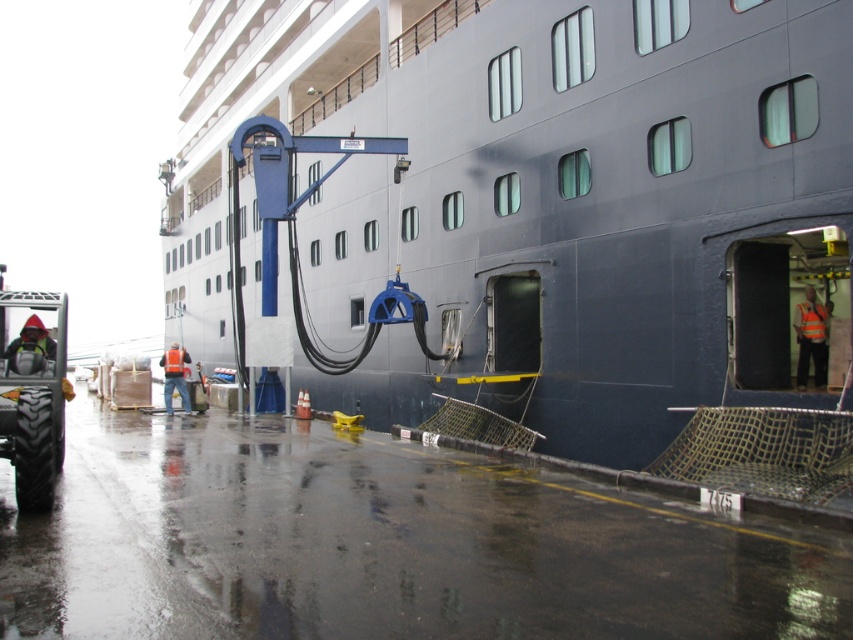
You are standing on the dock and want to board the dark blue metal cruise ship at center. The safety regulations state that passengers must be at least 10 meters away from the ship to avoid any crane operations. Are you within the safe distance?

The dark blue metal cruise ship at center is 9.86 meters from the viewer, which is less than the required 10 meters safety distance. Therefore, you are too close and should move further back to comply with the safety regulations.

You are standing at the dock and want to take a photo of the dark blue metal cruise ship at center and the brushed metal tractor at lower left. Which object should you focus on first to ensure both are in the frame?

You should focus on the dark blue metal cruise ship at center first because it is closer to you than the brushed metal tractor at lower left, so adjusting the camera to include it will also capture the tractor in the background.

You are a crane operator who needs to lift a heavy container from the brushed metal tractor at lower left and place it onto the dark blue metal cruise ship at center. Considering their heights, will the crane hook be able to reach the deck of the cruise ship without any adjustments?

The dark blue metal cruise ship at center is taller than the brushed metal tractor at lower left. Since the crane arm is already extended towards the ship, the crane hook should be able to reach the deck of the cruise ship as long as the crane can lift high enough based on the ship being taller than the tractor.